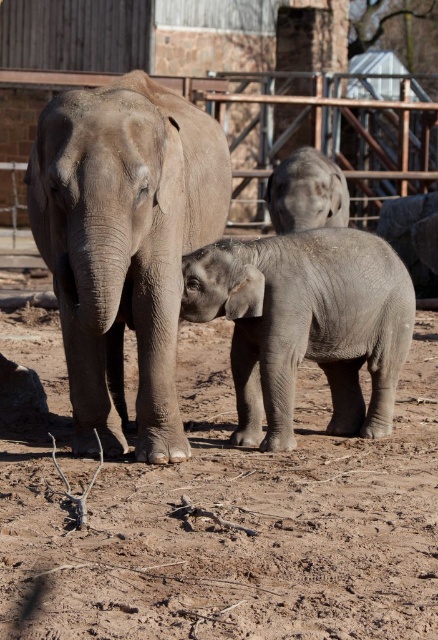
You are a zookeeper observing the elephants in their enclosure. You notice the gray textured elephant at center and the gray matte elephant at upper center. Which elephant is located higher up in the image?

The gray matte elephant at upper center is higher up in the image because it is positioned above the gray textured elephant at center.

You are standing at the entrance of the enclosure and see two points marked on the ground. The first point is at point (341, 330) and the second is at point (346, 122). If you want to walk towards the point that is closer to the elephants, which point should you head towards?

Point (341, 330) is in front of point (346, 122), so it is closer to the elephants. You should head towards point (341, 330).

You are a zookeeper planning to place a new feeding station between the gray textured elephant at center and the gray matte elephant at upper center. The feeding station requires a minimum of 3 meters of space to be placed safely. Can you place it between them?

The gray textured elephant at center is 3.22 meters from the gray matte elephant at upper center, which is more than the required 3 meters. Therefore, the feeding station can be safely placed between them.